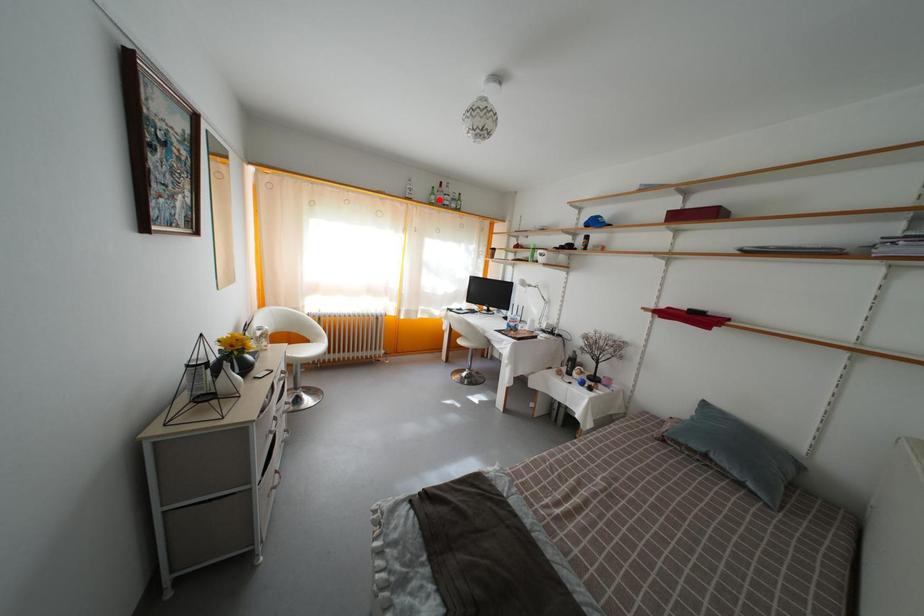
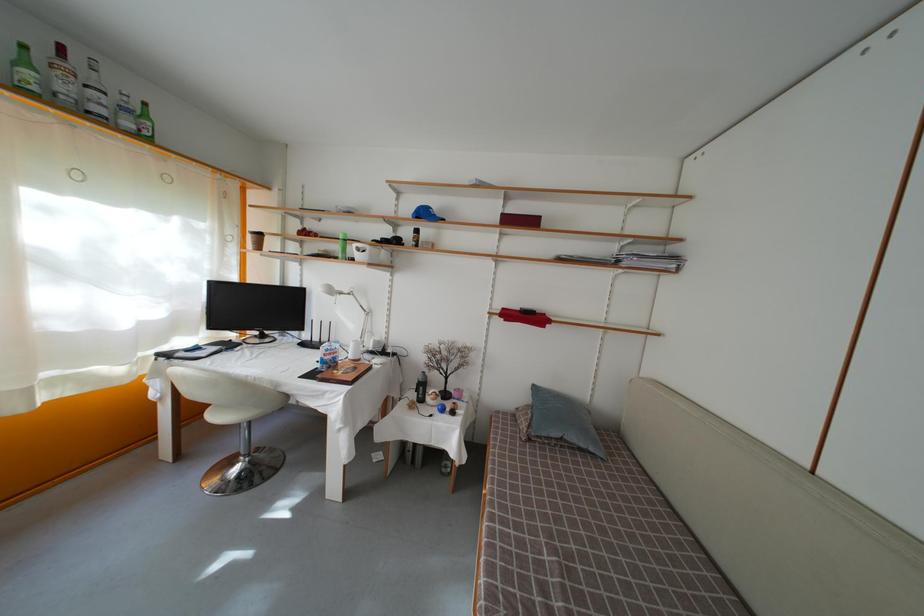
Where in the second image is the point corresponding to the highlighted location from the first image?

(31, 69)